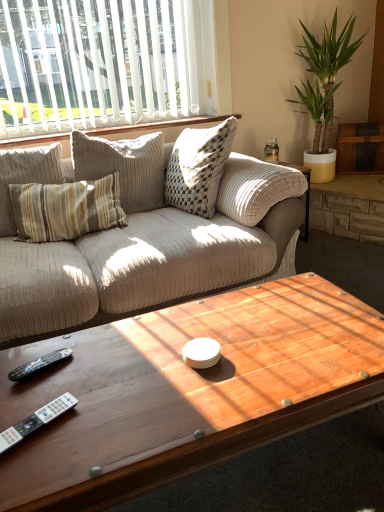
This screenshot has width=384, height=512. Identify the location of free space between white plastic remote at lower left and black plastic remote at lower left. (36, 395).